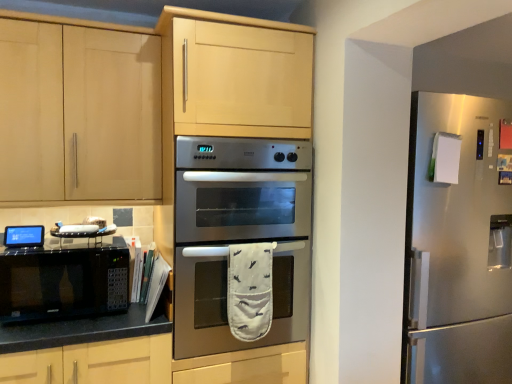
Question: Considering the relative sizes of satin silver refrigerator at right and stainless steel oven at center in the image provided, is satin silver refrigerator at right shorter than stainless steel oven at center?

Choices:
 (A) yes
 (B) no

Answer: (B)

Question: Is satin silver refrigerator at right positioned with its back to stainless steel oven at center?

Choices:
 (A) no
 (B) yes

Answer: (A)

Question: Does satin silver refrigerator at right appear on the right side of stainless steel oven at center?

Choices:
 (A) no
 (B) yes

Answer: (B)

Question: Can you confirm if satin silver refrigerator at right is bigger than stainless steel oven at center?

Choices:
 (A) yes
 (B) no

Answer: (A)

Question: Is satin silver refrigerator at right not within stainless steel oven at center?

Choices:
 (A) no
 (B) yes

Answer: (B)

Question: Is point (19, 180) closer or farther from the camera than point (301, 228)?

Choices:
 (A) closer
 (B) farther

Answer: (A)

Question: From the image's perspective, is matte wood cabinet at upper left located above or below stainless steel oven at center?

Choices:
 (A) below
 (B) above

Answer: (B)

Question: Considering their positions, is matte wood cabinet at upper left located in front of or behind stainless steel oven at center?

Choices:
 (A) behind
 (B) front

Answer: (A)

Question: From a real-world perspective, is matte wood cabinet at upper left physically located above or below stainless steel oven at center?

Choices:
 (A) above
 (B) below

Answer: (A)

Question: Would you say black matte microwave at left is inside or outside matte wood cabinet at upper left?

Choices:
 (A) outside
 (B) inside

Answer: (A)

Question: From the image's perspective, relative to matte wood cabinet at upper left, is black matte microwave at left above or below?

Choices:
 (A) below
 (B) above

Answer: (A)

Question: In terms of width, does black matte microwave at left look wider or thinner when compared to matte wood cabinet at upper left?

Choices:
 (A) wide
 (B) thin

Answer: (B)

Question: Is black matte microwave at left to the left or to the right of matte wood cabinet at upper left in the image?

Choices:
 (A) right
 (B) left

Answer: (B)

Question: Would you say satin silver refrigerator at right is to the left or to the right of matte wood cabinet at upper left in the picture?

Choices:
 (A) right
 (B) left

Answer: (A)

Question: Relative to matte wood cabinet at upper left, is satin silver refrigerator at right in front or behind?

Choices:
 (A) behind
 (B) front

Answer: (A)